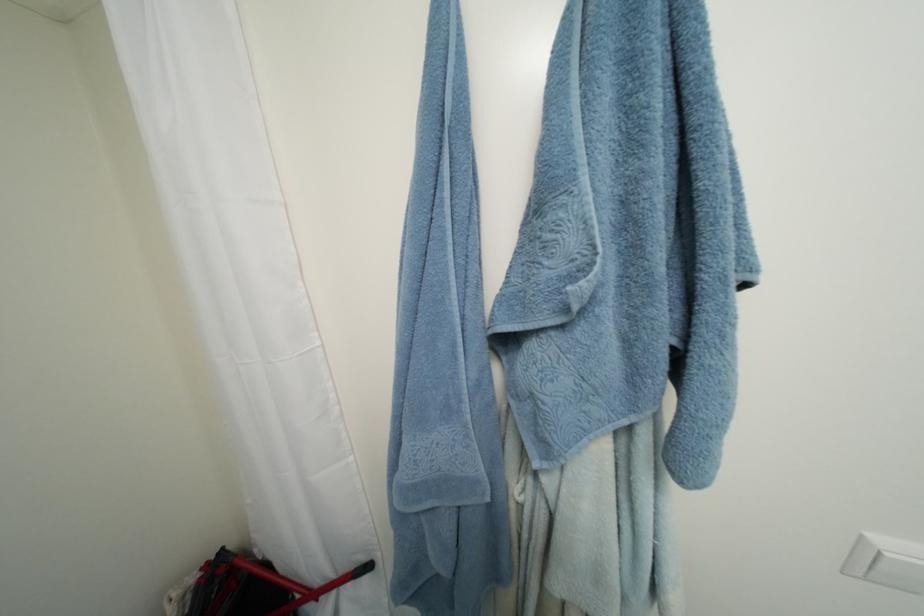
The width and height of the screenshot is (924, 616). Describe the element at coordinates (256, 588) in the screenshot. I see `the red frame handle` at that location.